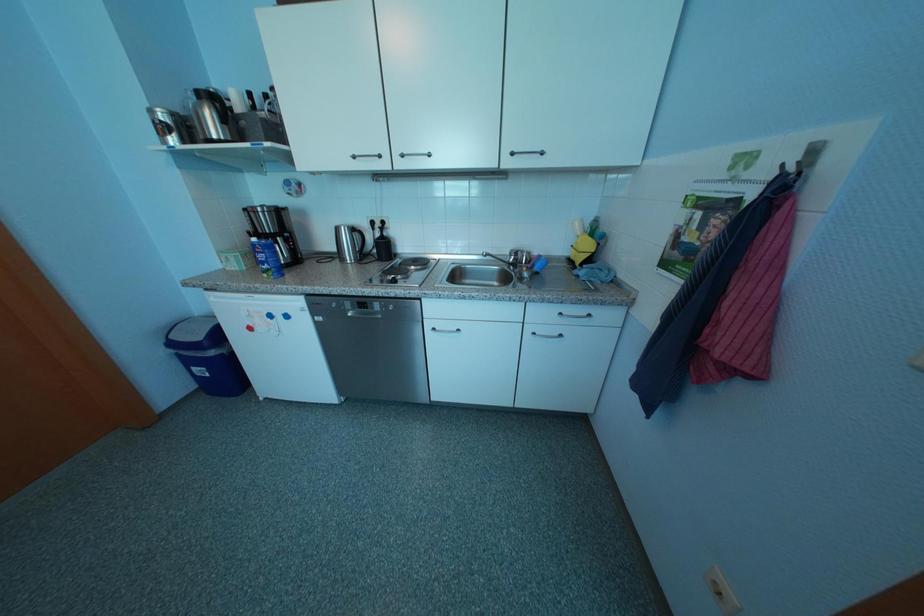
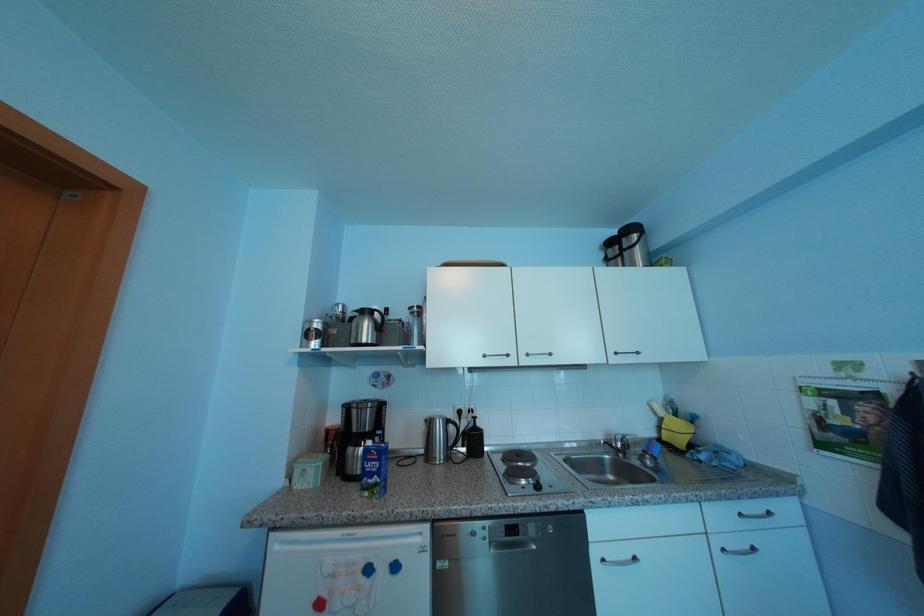
Question: The first image is from the beginning of the video and the second image is from the end. How did the camera likely rotate when shooting the video?

Choices:
 (A) Left
 (B) Right
 (C) Up
 (D) Down

Answer: (C)